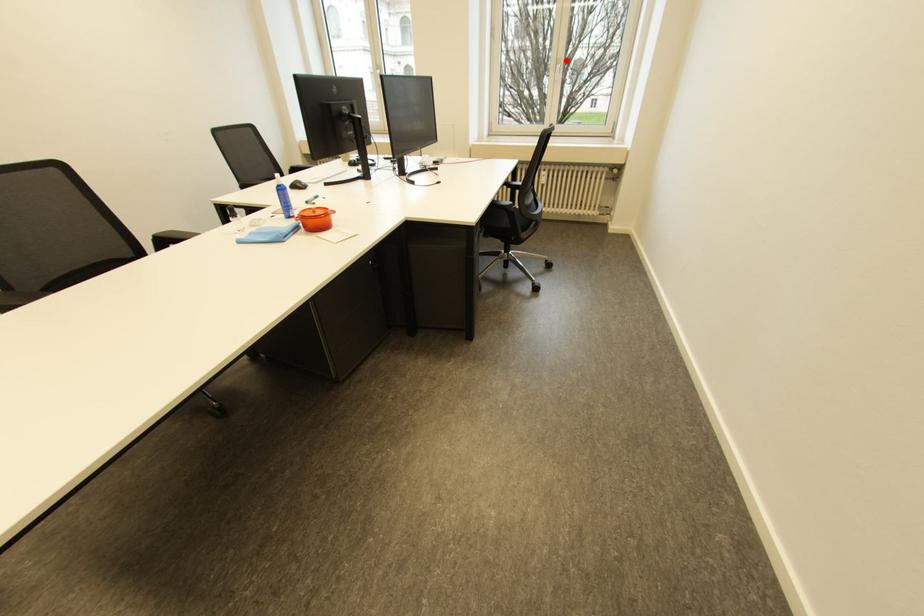
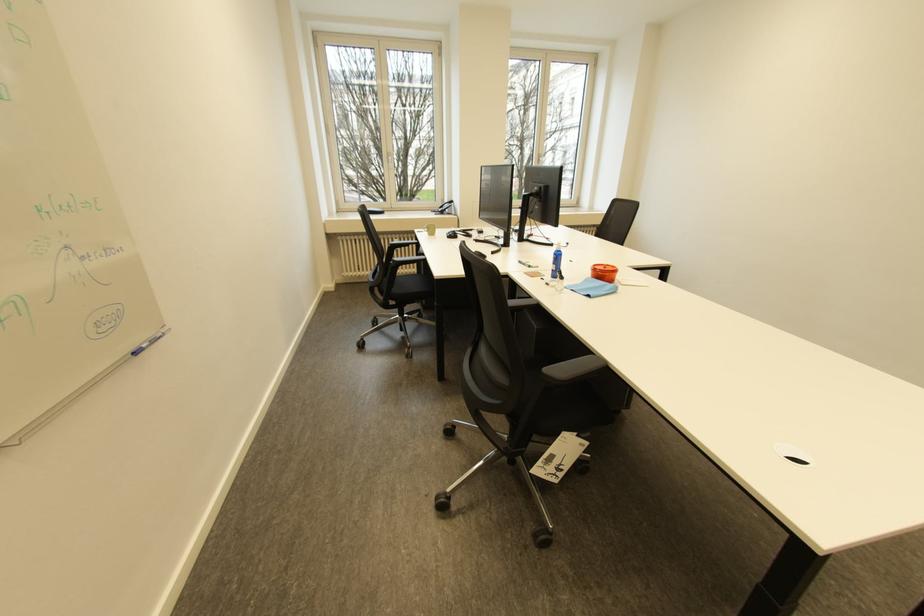
Locate, in the second image, the point that corresponds to the highlighted location in the first image.

(548, 156)